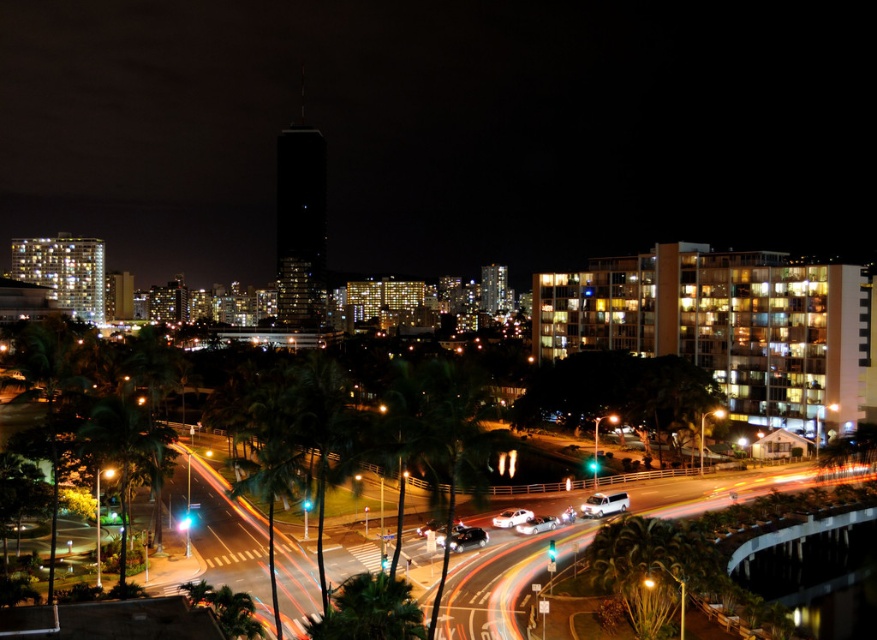
Question: Considering the relative positions of green leafy palm tree at lower left and white glossy car at center in the image provided, where is green leafy palm tree at lower left located with respect to white glossy car at center?

Choices:
 (A) right
 (B) left

Answer: (B)

Question: Is white matte van at lower center to the left of shiny silver sedan at center from the viewer's perspective?

Choices:
 (A) no
 (B) yes

Answer: (A)

Question: Is green leafy palm tree at lower left to the left of shiny silver sedan at center from the viewer's perspective?

Choices:
 (A) yes
 (B) no

Answer: (A)

Question: Among these points, which one is nearest to the camera?

Choices:
 (A) (125, 544)
 (B) (615, 492)

Answer: (A)

Question: Which object is the farthest from the white glossy car at center?

Choices:
 (A) white matte van at lower center
 (B) green leafy palm tree at lower left
 (C) shiny silver sedan at center

Answer: (B)

Question: Which is nearer to the white glossy car at center?

Choices:
 (A) white matte van at lower center
 (B) green leafy palm tree at lower left

Answer: (A)